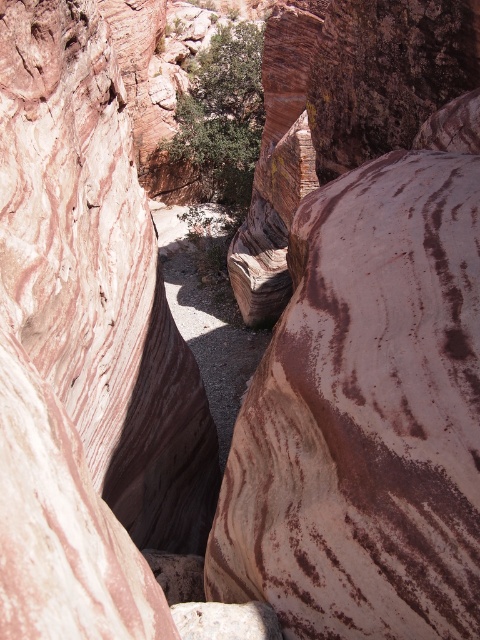
Between green leafy bush at center and white marble rock at center, which one is positioned higher?

green leafy bush at center

Does point (178, 97) lie behind point (263, 634)?

Yes, point (178, 97) is farther from viewer.

Is point (206, 161) positioned behind point (226, 634)?

Yes, it is.

Find the location of a particular element. green leafy bush at center is located at coordinates (223, 115).